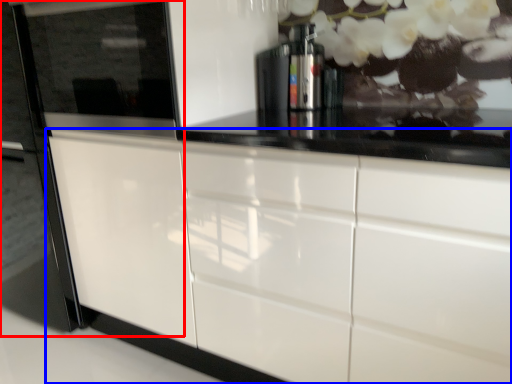
Question: Which object is further to the camera taking this photo, fridge (highlighted by a red box) or cabinetry (highlighted by a blue box)?

Choices:
 (A) fridge
 (B) cabinetry

Answer: (A)